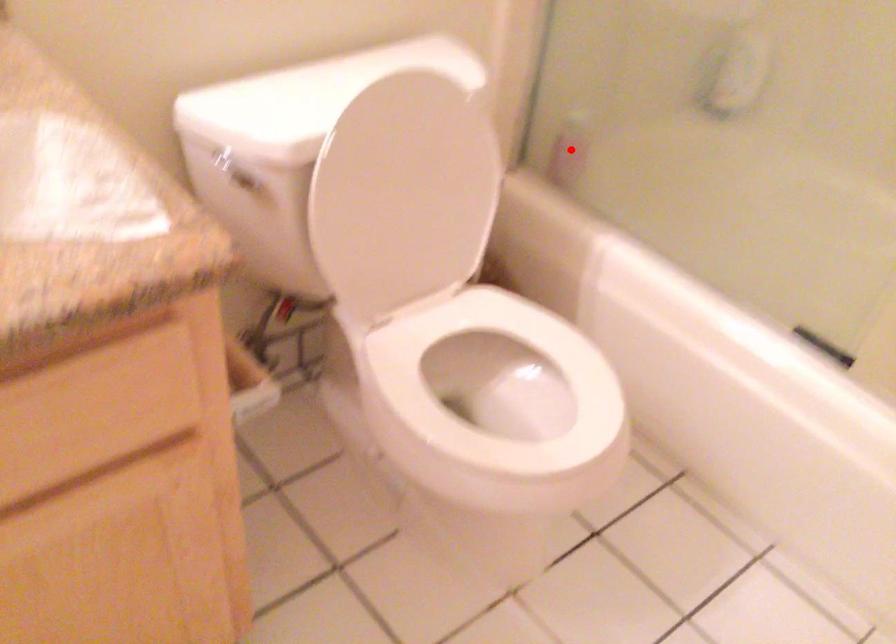
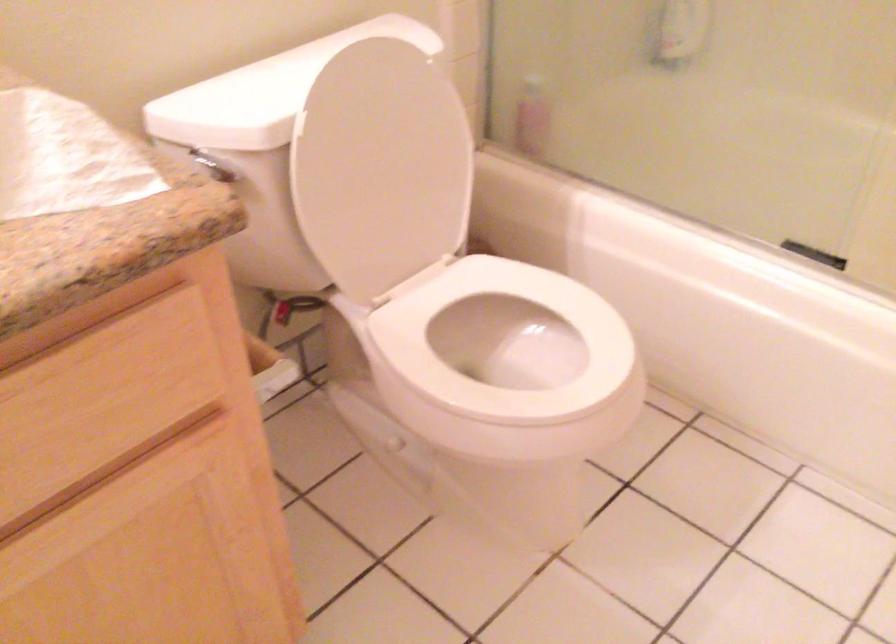
Question: I am providing you with two images of the same scene from different viewpoints. A red point is marked on the first image. Is the red point's position out of view in image 2?

Choices:
 (A) Yes
 (B) No

Answer: (B)